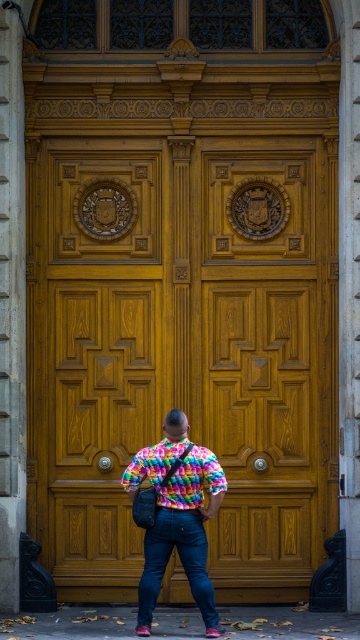
Which is below, wooden door at center or denim at center?

Positioned lower is denim at center.

This screenshot has width=360, height=640. Describe the element at coordinates (182, 348) in the screenshot. I see `wooden door at center` at that location.

Between point (213, 168) and point (151, 598), which one is positioned behind?

Point (213, 168)

You are a GUI agent. You are given a task and a screenshot of the screen. Output one action in this format:
    pyautogui.click(x=<x>, y=<y>)
    Task: Click on the wooden door at center
    This screenshot has width=360, height=640.
    Given the screenshot: What is the action you would take?
    click(x=182, y=348)

Can you confirm if wooden door at center is shorter than multicolored fabric shirt at center?

In fact, wooden door at center may be taller than multicolored fabric shirt at center.

Is wooden door at center smaller than multicolored fabric shirt at center?

No.

This screenshot has height=640, width=360. Describe the element at coordinates (182, 348) in the screenshot. I see `wooden door at center` at that location.

Find the location of a particular element. The width and height of the screenshot is (360, 640). wooden door at center is located at coordinates (182, 348).

Is point (169, 410) less distant than point (185, 444)?

No.

Is point (218, 484) positioned behind point (198, 490)?

No, (218, 484) is closer to viewer.

This screenshot has height=640, width=360. What are the coordinates of `multicolored fabric shirt at center` in the screenshot? It's located at (182, 536).